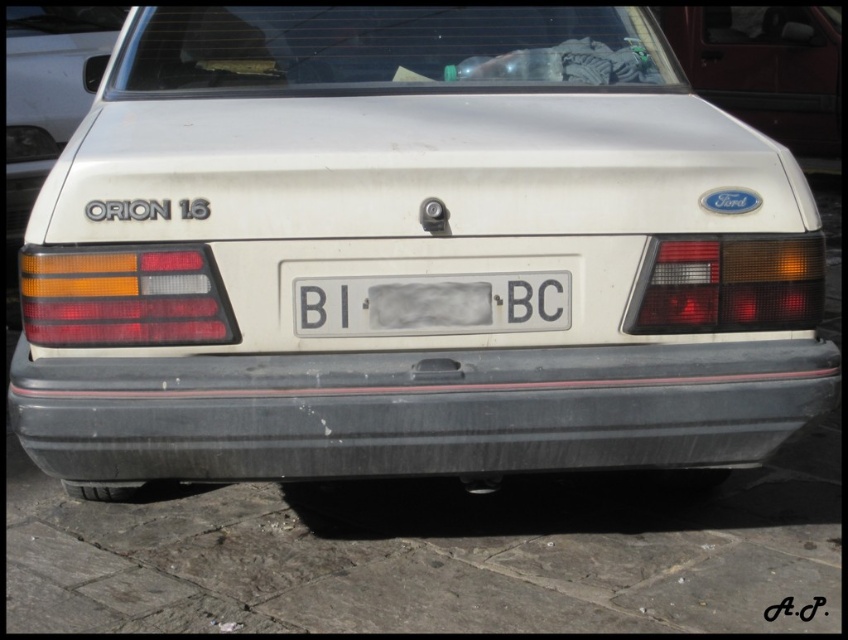
Does point (713, 13) come closer to viewer compared to point (349, 324)?

No, it is not.

Can you confirm if matte white car at upper right is shorter than white plastic license plate at center?

No, matte white car at upper right is not shorter than white plastic license plate at center.

At what (x,y) coordinates should I click in order to perform the action: click on matte white car at upper right. Please return your answer as a coordinate pair (x, y). Looking at the image, I should click on (765, 67).

Is point (20, 400) farther from camera compared to point (791, 38)?

No, it is not.

Identify the location of black matte bumper at center. The image size is (848, 640). (416, 410).

Is black matte bumper at center positioned behind white plastic license plate at center?

No, black matte bumper at center is closer to the viewer.

Does black matte bumper at center have a lesser height compared to white plastic license plate at center?

No.

Who is more distant from viewer, (x=73, y=356) or (x=545, y=317)?

The point (x=545, y=317) is more distant.

You are a GUI agent. You are given a task and a screenshot of the screen. Output one action in this format:
    pyautogui.click(x=<x>, y=<y>)
    Task: Click on the black matte bumper at center
    The width and height of the screenshot is (848, 640).
    Given the screenshot: What is the action you would take?
    pyautogui.click(x=416, y=410)